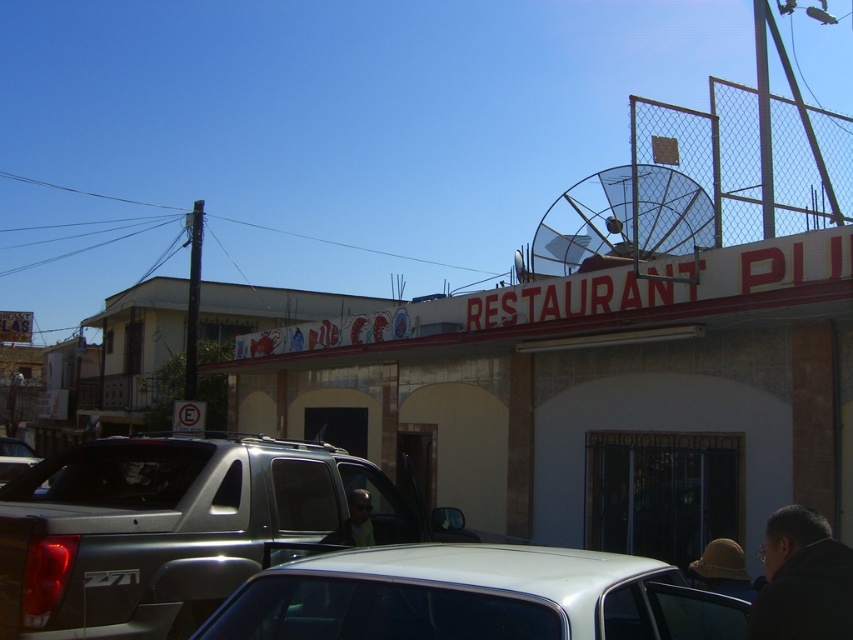
Can you confirm if silver metallic truck at center is taller than matte yellow shirt at center?

Yes.

Is silver metallic truck at center wider than matte yellow shirt at center?

Yes, silver metallic truck at center is wider than matte yellow shirt at center.

Who is more forward, (180, 605) or (352, 520)?

Point (180, 605) is in front.

Locate an element on the screen. silver metallic truck at center is located at coordinates (172, 529).

Can you confirm if white glossy car at lower center is taller than dark gray jacket at lower right?

Correct, white glossy car at lower center is much taller as dark gray jacket at lower right.

Is white glossy car at lower center below dark gray jacket at lower right?

Correct, white glossy car at lower center is located below dark gray jacket at lower right.

Which is behind, point (381, 584) or point (775, 541)?

Positioned behind is point (775, 541).

You are a GUI agent. You are given a task and a screenshot of the screen. Output one action in this format:
    pyautogui.click(x=<x>, y=<y>)
    Task: Click on the white glossy car at lower center
    The height and width of the screenshot is (640, 853).
    Given the screenshot: What is the action you would take?
    pyautogui.click(x=473, y=596)

Is brown felt hat at lower right thinner than silver metallic truck at lower left?

Correct, brown felt hat at lower right's width is less than silver metallic truck at lower left's.

You are a GUI agent. You are given a task and a screenshot of the screen. Output one action in this format:
    pyautogui.click(x=<x>, y=<y>)
    Task: Click on the brown felt hat at lower right
    The width and height of the screenshot is (853, 640).
    Given the screenshot: What is the action you would take?
    pyautogui.click(x=723, y=570)